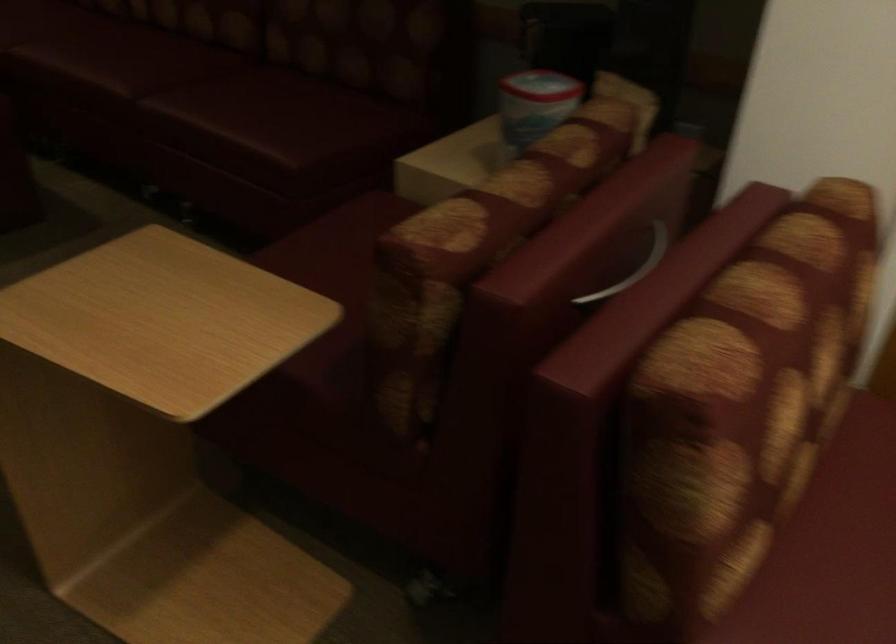
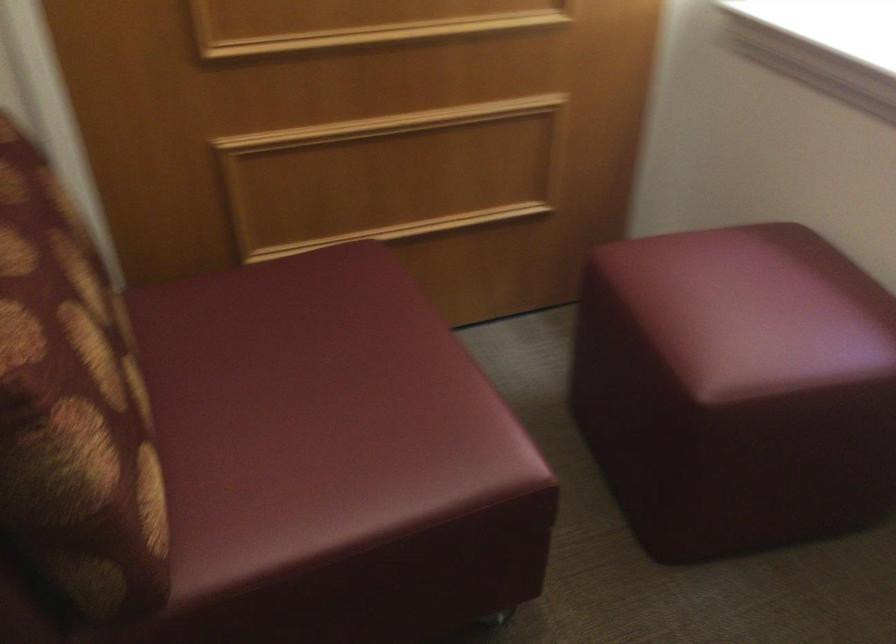
The point at (748, 448) is marked in the first image. Where is the corresponding point in the second image?

(72, 406)